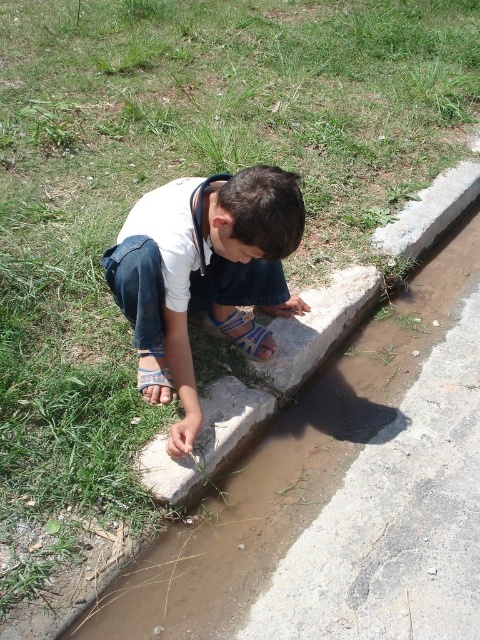
Who is lower down, white cotton shirt at center or denim at left?

Positioned lower is white cotton shirt at center.

From the picture: Who is more distant from viewer, (x=179, y=317) or (x=153, y=262)?

Positioned behind is point (x=179, y=317).

Is point (189, 412) farther from camera compared to point (226, 282)?

No.

This screenshot has height=640, width=480. Find the location of `white cotton shirt at center`. white cotton shirt at center is located at coordinates (204, 275).